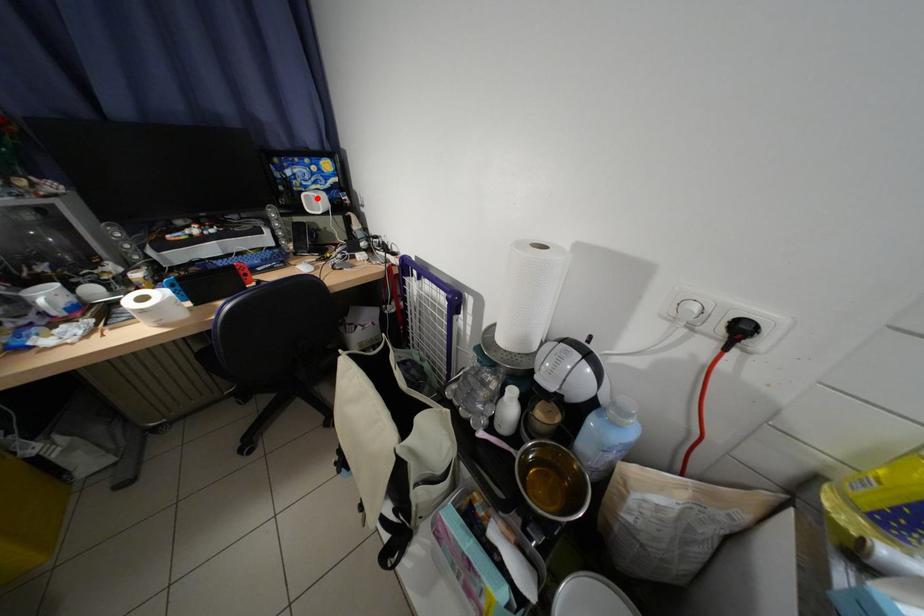
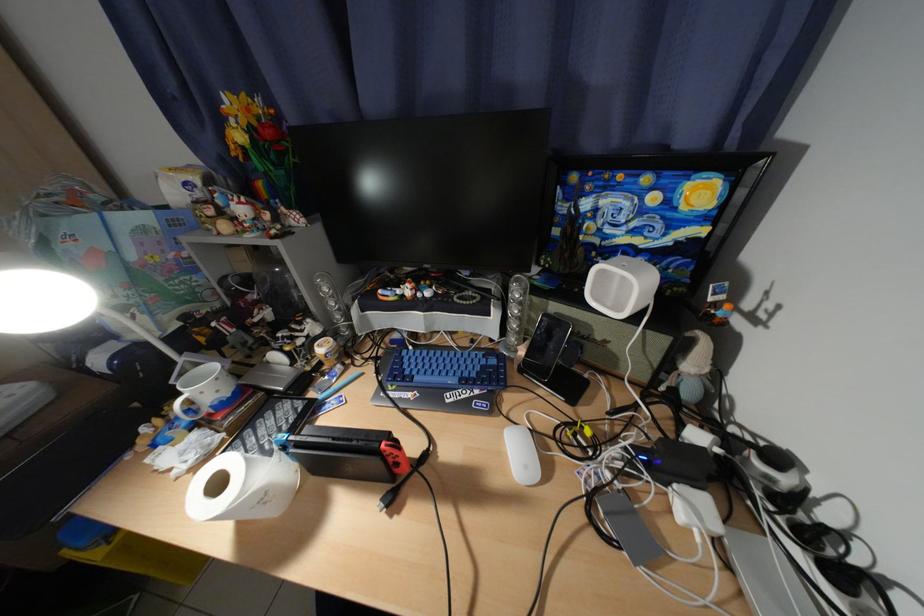
Question: I am providing you with two images of the same scene from different viewpoints. A red point is marked on the first image. Can you still see the location of the red point in image 2?

Choices:
 (A) Yes
 (B) No

Answer: (A)